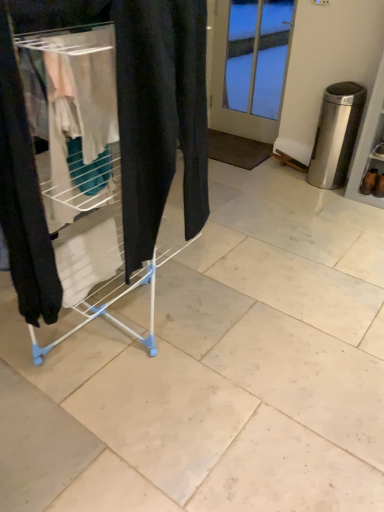
At what (x,y) coordinates should I click in order to perform the action: click on free space in front of satin silver trash can at right. Please return your answer as a coordinate pair (x, y). The width and height of the screenshot is (384, 512). Looking at the image, I should click on (331, 200).